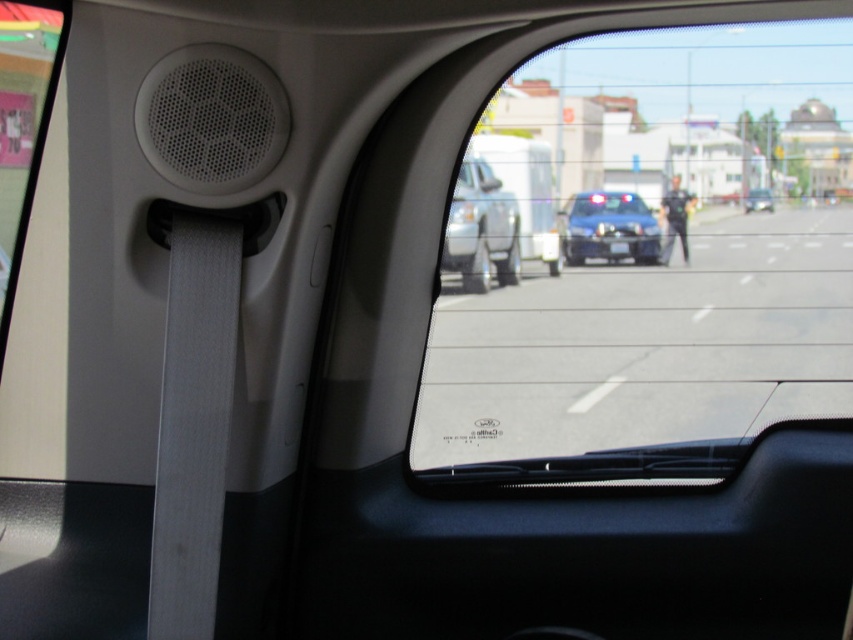
You are a passenger in the car and looking through the windshield. You see the blue metallic police car at center and the clear plastic mirror at center. Which object appears taller from your perspective?

The blue metallic police car at center appears much taller than the clear plastic mirror at center from your perspective.